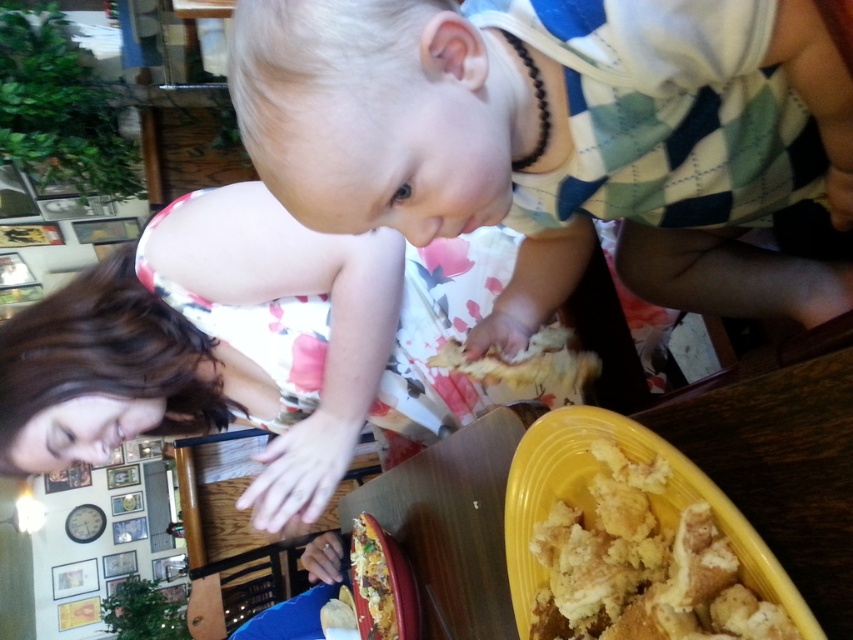
From the picture: Is soft white baby at center wider than crumbly golden bread at lower center?

Indeed, soft white baby at center has a greater width compared to crumbly golden bread at lower center.

Is point (428, 145) closer to camera compared to point (396, 625)?

Yes, it is in front of point (396, 625).

Is point (445, 8) in front of point (361, 550)?

Yes.

You are a GUI agent. You are given a task and a screenshot of the screen. Output one action in this format:
    pyautogui.click(x=<x>, y=<y>)
    Task: Click on the soft white baby at center
    
    Given the screenshot: What is the action you would take?
    pyautogui.click(x=560, y=138)

Can you confirm if golden crumbly bread at center is smaller than crumbly golden bread at lower center?

Actually, golden crumbly bread at center might be larger than crumbly golden bread at lower center.

Who is shorter, golden crumbly bread at center or crumbly golden bread at lower center?

golden crumbly bread at center

Is point (503, 369) positioned behind point (398, 572)?

No, (503, 369) is in front of (398, 572).

Locate an element on the screen. golden crumbly bread at center is located at coordinates (527, 362).

Is soft white baby at center closer to camera compared to golden crumbly bread at center?

Yes.

Does point (242, 60) come in front of point (544, 348)?

Yes, point (242, 60) is in front of point (544, 348).

Is point (714, 36) farther from camera compared to point (566, 384)?

That is False.

This screenshot has height=640, width=853. What are the coordinates of `soft white baby at center` in the screenshot? It's located at (560, 138).